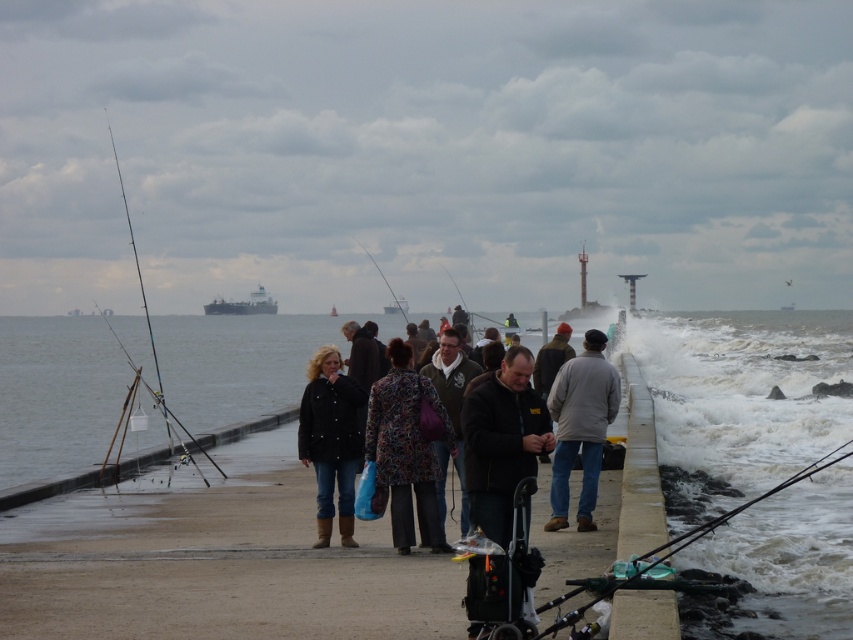
Question: Which point appears farthest from the camera in this image?

Choices:
 (A) (432, 412)
 (B) (172, 323)
 (C) (376, 404)

Answer: (B)

Question: Can you confirm if metallic fishing pole at left is positioned to the left of matte black fishing pole at center?

Choices:
 (A) no
 (B) yes

Answer: (B)

Question: Is white matte ship at center positioned behind shiny metallic fishing pole at center?

Choices:
 (A) no
 (B) yes

Answer: (B)

Question: Which object appears closest to the camera in this image?

Choices:
 (A) metallic fishing pole at left
 (B) dark green sweater at center
 (C) white matte ship at center
 (D) metallic gray ship at center

Answer: (B)

Question: Can you confirm if matte black fishing pole at center is positioned above shiny metallic fishing pole at center?

Choices:
 (A) no
 (B) yes

Answer: (B)

Question: Considering the real-world distances, which object is farthest from the dark green sweater at center?

Choices:
 (A) matte black fishing pole at center
 (B) shiny metallic fishing pole at left
 (C) metallic fishing pole at left

Answer: (A)